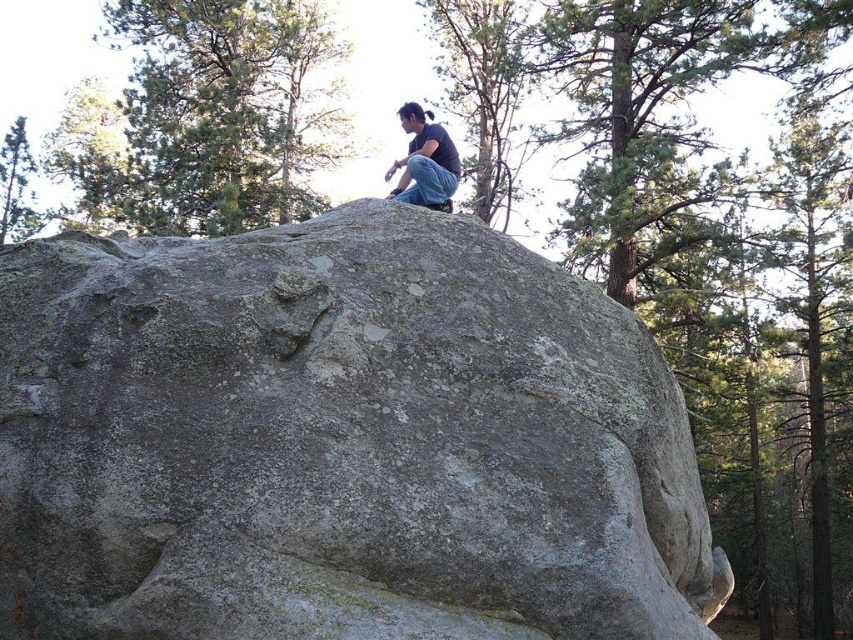
In the scene shown: Does gray rough rock at center appear over green textured tree at upper left?

Actually, gray rough rock at center is below green textured tree at upper left.

Identify the location of gray rough rock at center. (339, 442).

This screenshot has width=853, height=640. What do you see at coordinates (339, 442) in the screenshot? I see `gray rough rock at center` at bounding box center [339, 442].

This screenshot has height=640, width=853. I want to click on gray rough rock at center, so click(x=339, y=442).

Which is behind, point (152, 8) or point (28, 214)?

Point (28, 214)

Is green leafy tree at upper left shorter than green textured tree at upper left?

No.

Between point (289, 8) and point (10, 150), which one is positioned behind?

Positioned behind is point (289, 8).

The height and width of the screenshot is (640, 853). Find the location of `green leafy tree at upper left`. green leafy tree at upper left is located at coordinates (206, 116).

Who is positioned more to the left, green leafy tree at upper left or black matte shirt at upper center?

From the viewer's perspective, green leafy tree at upper left appears more on the left side.

Does green leafy tree at upper left appear on the left side of black matte shirt at upper center?

Correct, you'll find green leafy tree at upper left to the left of black matte shirt at upper center.

This screenshot has width=853, height=640. Find the location of `green leafy tree at upper left`. green leafy tree at upper left is located at coordinates (206, 116).